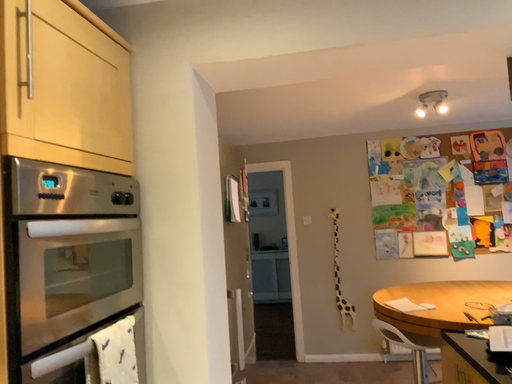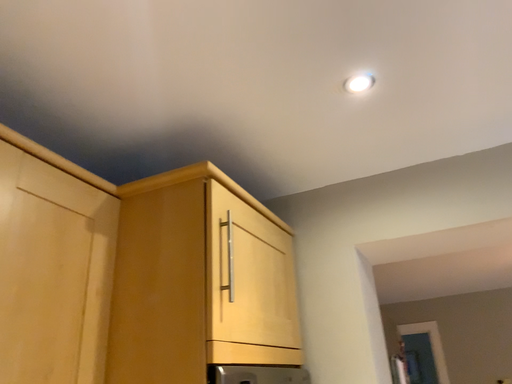
Question: How did the camera likely rotate when shooting the video?

Choices:
 (A) rotated left
 (B) rotated right

Answer: (A)